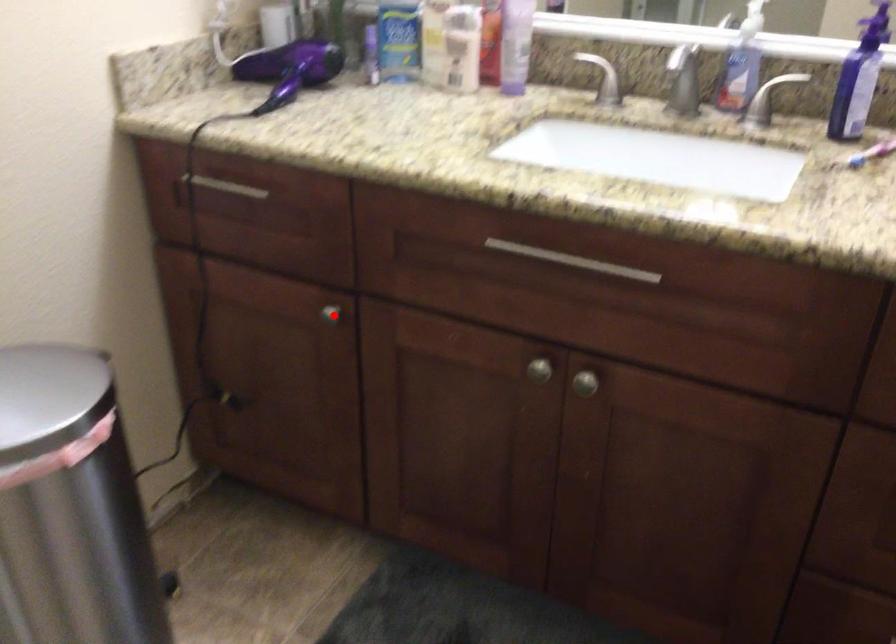
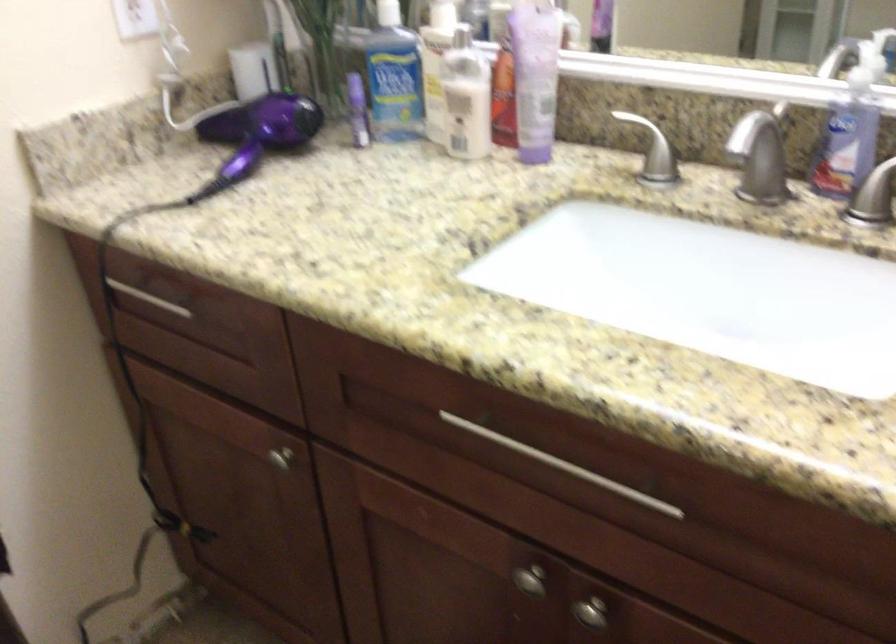
Question: I am providing you with two images of the same scene from different viewpoints. Image1 has a red point marked. In image2, the corresponding 3D location appears at what relative position? Reply with the corresponding letter.

Choices:
 (A) Closer
 (B) Farther

Answer: (A)